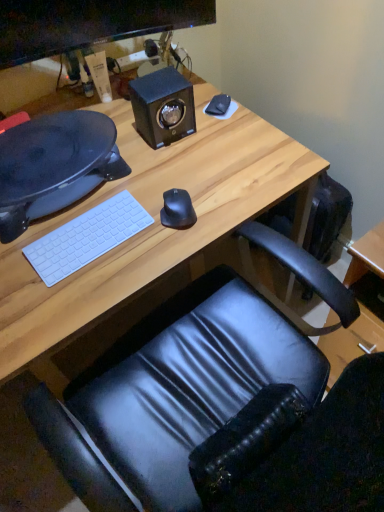
Where is `free space to the left of white matte keyboard at lower left`? This screenshot has width=384, height=512. free space to the left of white matte keyboard at lower left is located at coordinates (27, 249).